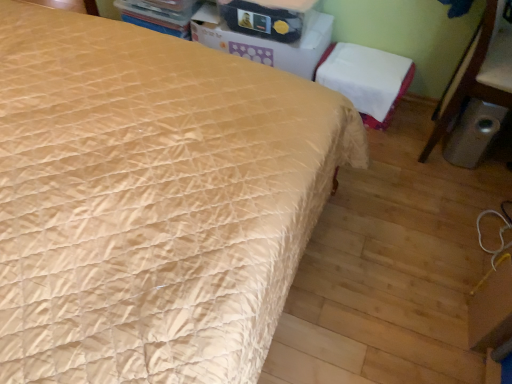
Question: From the image's perspective, is white cardboard box at upper center under metallic trash can at lower right?

Choices:
 (A) no
 (B) yes

Answer: (A)

Question: Does white cardboard box at upper center have a smaller size compared to metallic trash can at lower right?

Choices:
 (A) no
 (B) yes

Answer: (B)

Question: Does white cardboard box at upper center appear on the left side of metallic trash can at lower right?

Choices:
 (A) yes
 (B) no

Answer: (A)

Question: Is white cardboard box at upper center positioned in front of metallic trash can at lower right?

Choices:
 (A) yes
 (B) no

Answer: (B)

Question: From a real-world perspective, is white cardboard box at upper center on metallic trash can at lower right?

Choices:
 (A) yes
 (B) no

Answer: (B)

Question: Visually, is white fabric chair at upper right positioned to the left or to the right of metallic trash can at lower right?

Choices:
 (A) right
 (B) left

Answer: (B)

Question: Is white fabric chair at upper right in front of or behind metallic trash can at lower right in the image?

Choices:
 (A) front
 (B) behind

Answer: (B)

Question: Is white fabric chair at upper right taller or shorter than metallic trash can at lower right?

Choices:
 (A) tall
 (B) short

Answer: (B)

Question: In terms of size, does white fabric chair at upper right appear bigger or smaller than metallic trash can at lower right?

Choices:
 (A) small
 (B) big

Answer: (A)

Question: From the image's perspective, relative to white cardboard box at upper center, is white fabric chair at upper right above or below?

Choices:
 (A) above
 (B) below

Answer: (B)

Question: Based on their positions, is white fabric chair at upper right located to the left or right of white cardboard box at upper center?

Choices:
 (A) left
 (B) right

Answer: (B)

Question: Relative to white cardboard box at upper center, is white fabric chair at upper right in front or behind?

Choices:
 (A) front
 (B) behind

Answer: (B)

Question: Looking at their shapes, would you say white fabric chair at upper right is wider or thinner than white cardboard box at upper center?

Choices:
 (A) wide
 (B) thin

Answer: (B)

Question: Considering the relative positions of matte cardboard box at upper center and white cardboard box at upper center in the image provided, is matte cardboard box at upper center to the left or to the right of white cardboard box at upper center?

Choices:
 (A) right
 (B) left

Answer: (A)

Question: Looking at the image, does matte cardboard box at upper center seem bigger or smaller compared to white cardboard box at upper center?

Choices:
 (A) small
 (B) big

Answer: (A)